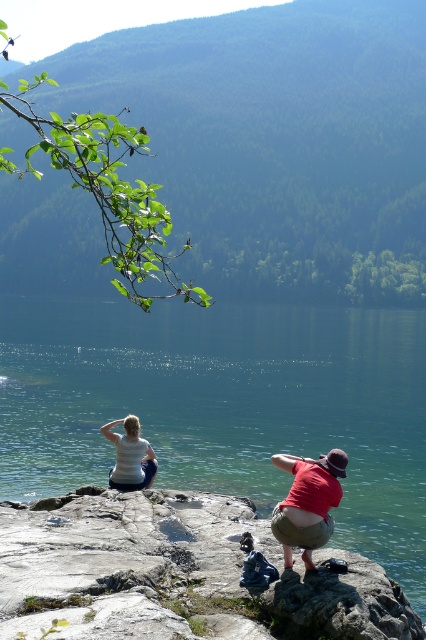
Does white cotton shirt at center have a lesser width compared to white matte shirt at center?

No, white cotton shirt at center is not thinner than white matte shirt at center.

Who is positioned more to the left, white cotton shirt at center or white matte shirt at center?

From the viewer's perspective, white matte shirt at center appears more on the left side.

Does point (302, 516) come behind point (144, 480)?

No.

This screenshot has height=640, width=426. I want to click on white cotton shirt at center, so click(307, 502).

Does point (120, 566) come closer to viewer compared to point (285, 561)?

That is True.

Is point (123, 492) more distant than point (282, 458)?

Yes.

Find the location of a particular element. The image size is (426, 640). rough textured rock at center is located at coordinates (176, 573).

Does green stone lake at center appear on the left side of white matte shirt at center?

Indeed, green stone lake at center is positioned on the left side of white matte shirt at center.

Who is positioned more to the left, green stone lake at center or white matte shirt at center?

From the viewer's perspective, green stone lake at center appears more on the left side.

In order to click on green stone lake at center in this screenshot , I will do `click(226, 404)`.

Locate an element on the screen. green stone lake at center is located at coordinates (226, 404).